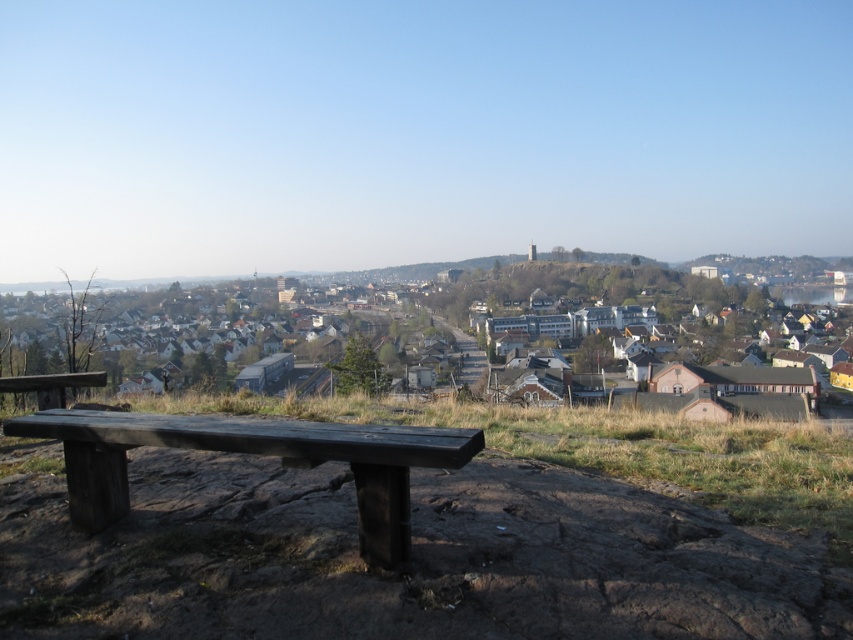
Question: Which point appears closest to the camera in this image?

Choices:
 (A) (36, 381)
 (B) (718, 413)
 (C) (486, 412)

Answer: (A)

Question: Observing the image, what is the correct spatial positioning of dark brown wood bench at lower left in reference to matte brown houses at center?

Choices:
 (A) below
 (B) above

Answer: (A)

Question: Is dark brown wood bench at lower left further to camera compared to wooden bench at lower left?

Choices:
 (A) yes
 (B) no

Answer: (B)

Question: Considering the relative positions of matte brown houses at center and wooden bench at lower left in the image provided, where is matte brown houses at center located with respect to wooden bench at lower left?

Choices:
 (A) left
 (B) right

Answer: (B)

Question: Among these objects, which one is nearest to the camera?

Choices:
 (A) wooden bench at lower left
 (B) dark brown wood bench at lower left
 (C) matte brown houses at center

Answer: (B)

Question: Which of the following is the farthest from the observer?

Choices:
 (A) (334, 408)
 (B) (746, 400)

Answer: (B)